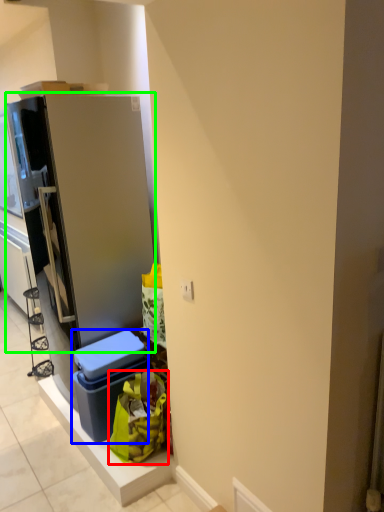
Question: Based on their relative distances, which object is farther from garbage (highlighted by a red box)? Choose from storage box (highlighted by a blue box) and refrigerator (highlighted by a green box).

Choices:
 (A) storage box
 (B) refrigerator

Answer: (B)